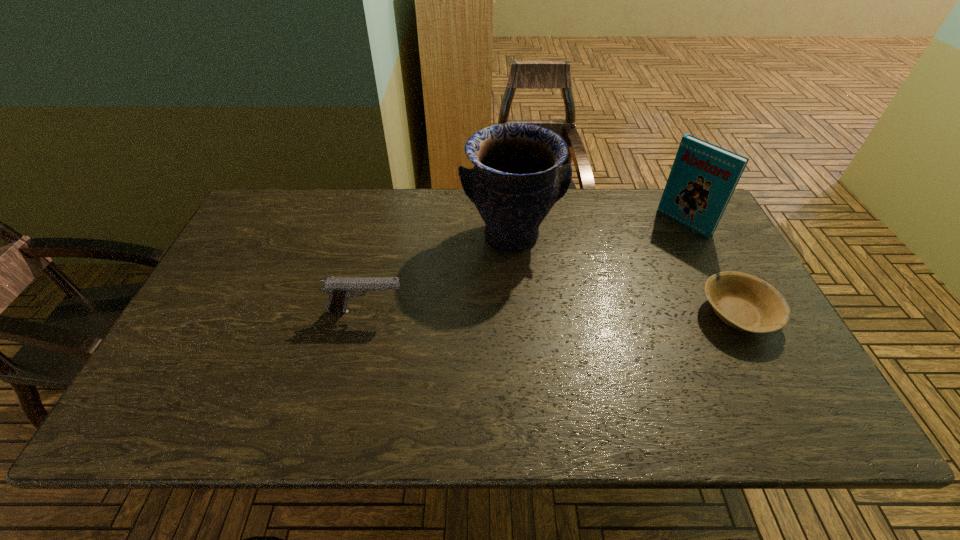
Where is `free spot between the pottery and the book`? free spot between the pottery and the book is located at coordinates (597, 229).

The width and height of the screenshot is (960, 540). I want to click on free point between the pistol and the second object from left to right, so click(x=439, y=273).

Identify the location of free space between the pistol and the shortest object. This screenshot has height=540, width=960. (552, 313).

At what (x,y) coordinates should I click in order to perform the action: click on the third closest object relative to the pistol. Please return your answer as a coordinate pair (x, y). Looking at the image, I should click on (703, 177).

Identify the location of object that stands as the second closest to the pistol. The height and width of the screenshot is (540, 960). (745, 302).